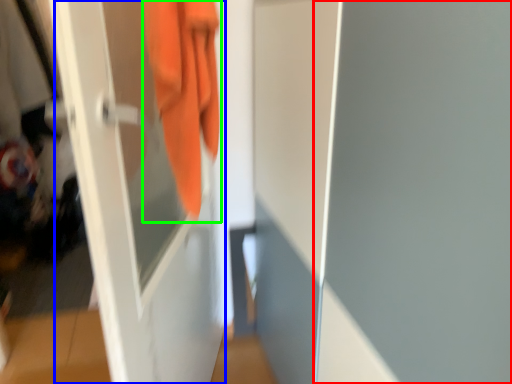
Question: Considering the real-world distances, which object is farthest from screen door (highlighted by a red box)? screen door (highlighted by a blue box) or towel (highlighted by a green box)?

Choices:
 (A) screen door
 (B) towel

Answer: (A)